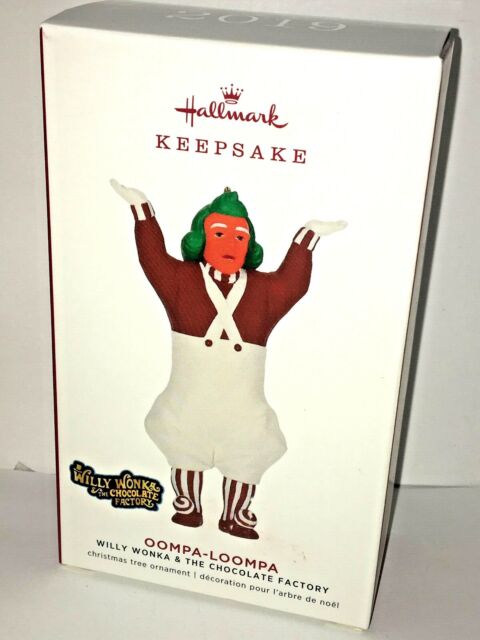
At what (x,y) coordinates should I click in order to perform the action: click on box. Please return your answer as a coordinate pair (x, y). The width and height of the screenshot is (480, 640). Looking at the image, I should click on (299, 369).